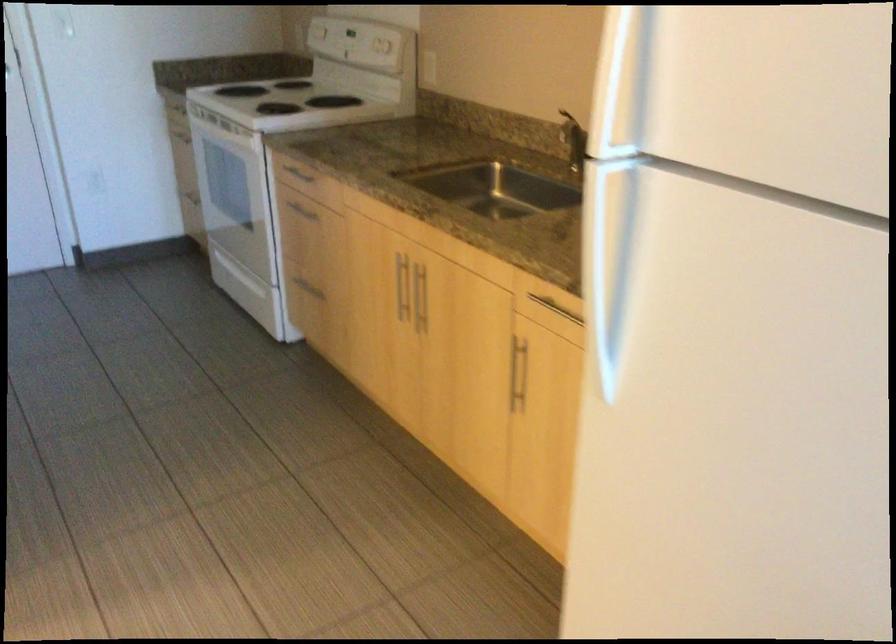
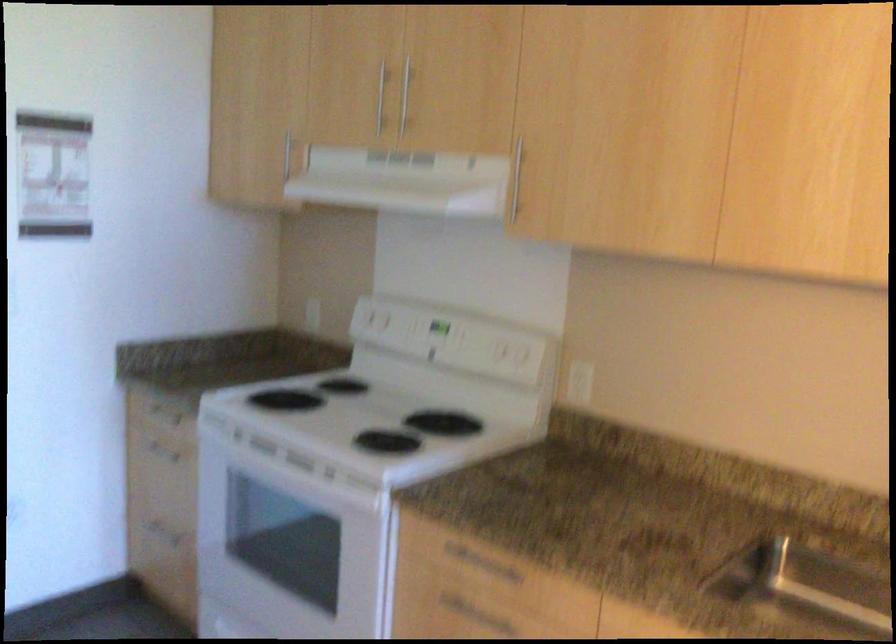
In the second image, find the point that corresponds to point (264, 194) in the first image.

(385, 571)